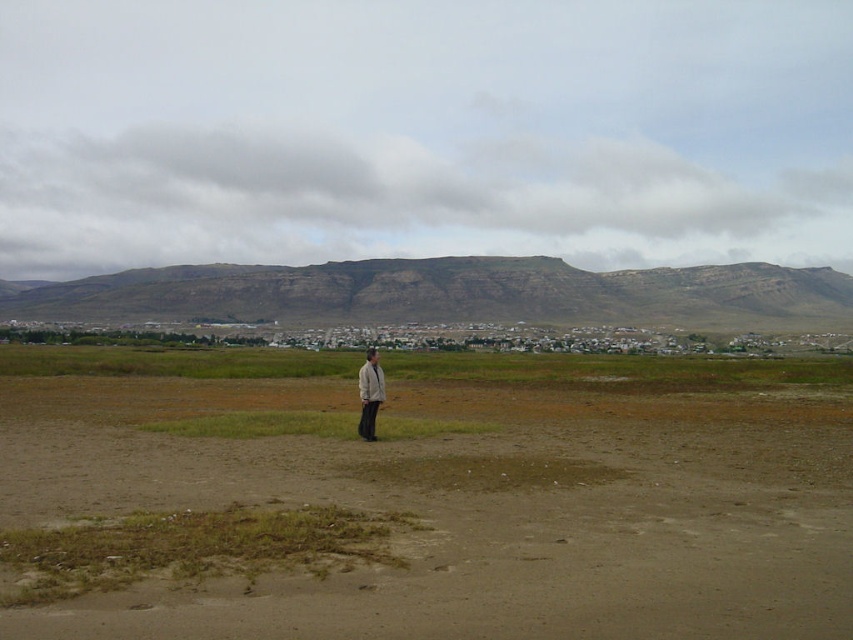
Question: Observing the image, what is the correct spatial positioning of brown sandy dirt field at center in reference to light beige fabric jacket at center?

Choices:
 (A) right
 (B) left

Answer: (A)

Question: Which of the following is the farthest from the observer?

Choices:
 (A) brown rocky mountain at upper center
 (B) light beige fabric jacket at center
 (C) brown sandy dirt field at center

Answer: (A)

Question: Which point is farther to the camera?

Choices:
 (A) light beige fabric jacket at center
 (B) brown rocky mountain at upper center
 (C) brown sandy dirt field at center

Answer: (B)

Question: Which point is closer to the camera taking this photo?

Choices:
 (A) (27, 292)
 (B) (363, 433)

Answer: (B)

Question: Does brown sandy dirt field at center appear on the right side of brown rocky mountain at upper center?

Choices:
 (A) no
 (B) yes

Answer: (A)

Question: Does brown sandy dirt field at center have a smaller size compared to brown rocky mountain at upper center?

Choices:
 (A) no
 (B) yes

Answer: (B)